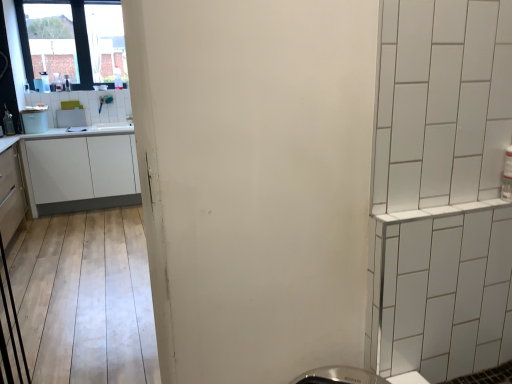
Question: Is white glossy microwave at upper left, which is counted as the 1th appliance, starting from the back, bigger or smaller than white matte cabinet at left, the second cabinetry viewed from the front?

Choices:
 (A) small
 (B) big

Answer: (A)

Question: From a real-world perspective, is white glossy microwave at upper left, which ranks as the 2th appliance in front-to-back order, above or below white matte cabinet at left, positioned as the 1th cabinetry in back-to-front order?

Choices:
 (A) above
 (B) below

Answer: (A)

Question: Which object is the farthest from the transparent glass window at upper left?

Choices:
 (A) white glossy trash can at left, which appears as the first appliance when viewed from the front
 (B) white glossy microwave at upper left, which is counted as the 1th appliance, starting from the back
 (C) white matte cabinet at left, positioned as the 1th cabinetry in back-to-front order
 (D) matte white cabinet at left, the 1th cabinetry viewed from the front

Answer: (D)

Question: Estimate the real-world distances between objects in this image. Which object is farther from the white matte cabinet at left, positioned as the 1th cabinetry in back-to-front order?

Choices:
 (A) white glossy trash can at left, which appears as the first appliance when viewed from the front
 (B) transparent glass window at upper left
 (C) white glossy microwave at upper left, which ranks as the 2th appliance in front-to-back order
 (D) matte white cabinet at left, the 1th cabinetry viewed from the front

Answer: (B)